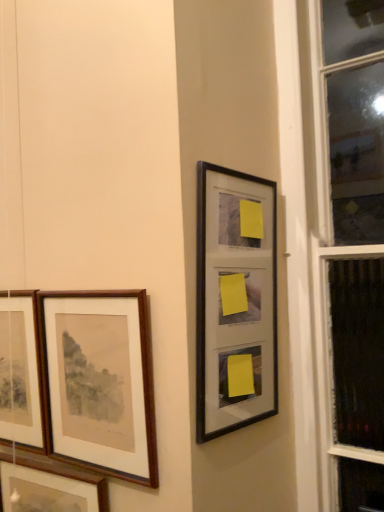
What do you see at coordinates (100, 381) in the screenshot? I see `wooden frame at left, placed as the second picture frame when sorted from right to left` at bounding box center [100, 381].

In order to face wooden framed picture at left, which ranks as the second picture frame in left-to-right order, should I rotate leftwards or rightwards?

You should look left and rotate roughly 18.734 degrees.

In order to face wooden picture frame at left, arranged as the fourth picture frame when viewed from the right, should I rotate leftwards or rightwards?

Rotate left and turn 24.182 degrees.

Identify the location of wooden frame at left, placed as the 3th picture frame when sorted from left to right. (100, 381).

Would you consider black matte picture frame at upper right, which is counted as the 1th picture frame, starting from the right, to be distant from wooden framed picture at left, positioned as the 3th picture frame in right-to-left order?

They are positioned close to each other.

From a real-world perspective, starting from the wooden framed picture at left, positioned as the 3th picture frame in right-to-left order, which picture frame is the 3rd one vertically above it? Please provide its 2D coordinates.

[(235, 301)]

What's the angular difference between black matte picture frame at upper right, which is counted as the 1th picture frame, starting from the right, and wooden framed picture at left, which ranks as the second picture frame in left-to-right order,'s facing directions?

The angle between the facing direction of black matte picture frame at upper right, which is counted as the 1th picture frame, starting from the right, and the facing direction of wooden framed picture at left, which ranks as the second picture frame in left-to-right order, is 77.6 degrees.

From the image's perspective, is black matte picture frame at upper right, which is counted as the 1th picture frame, starting from the right, located above or below wooden framed picture at left, which ranks as the second picture frame in left-to-right order?

black matte picture frame at upper right, which is counted as the 1th picture frame, starting from the right, is situated higher than wooden framed picture at left, which ranks as the second picture frame in left-to-right order, in the image.

Is wooden picture frame at left, arranged as the fourth picture frame when viewed from the right, behind wooden framed picture at left, which ranks as the second picture frame in left-to-right order?

Yes.

From the image's perspective, which is above, wooden picture frame at left, arranged as the fourth picture frame when viewed from the right, or wooden framed picture at left, which ranks as the second picture frame in left-to-right order?

wooden picture frame at left, arranged as the fourth picture frame when viewed from the right, appears higher in the image.

In terms of width, does wooden picture frame at left, arranged as the fourth picture frame when viewed from the right, look wider or thinner when compared to wooden framed picture at left, which ranks as the second picture frame in left-to-right order?

In the image, wooden picture frame at left, arranged as the fourth picture frame when viewed from the right, appears to be more narrow than wooden framed picture at left, which ranks as the second picture frame in left-to-right order.

Looking at this image, is wooden frame at left, placed as the 3th picture frame when sorted from left to right, not close to wooden picture frame at left, arranged as the fourth picture frame when viewed from the right?

They are positioned close to each other.

Considering the relative sizes of wooden frame at left, placed as the second picture frame when sorted from right to left, and wooden picture frame at left, the first picture frame from the left, in the image provided, is wooden frame at left, placed as the second picture frame when sorted from right to left, shorter than wooden picture frame at left, the first picture frame from the left,?

Correct, wooden frame at left, placed as the second picture frame when sorted from right to left, is not as tall as wooden picture frame at left, the first picture frame from the left.

From the image's perspective, does wooden frame at left, placed as the second picture frame when sorted from right to left, appear lower than wooden picture frame at left, arranged as the fourth picture frame when viewed from the right?

Incorrect, from the image's perspective, wooden frame at left, placed as the second picture frame when sorted from right to left, is higher than wooden picture frame at left, arranged as the fourth picture frame when viewed from the right.

Which of these two, wooden picture frame at left, the first picture frame from the left, or wooden frame at left, placed as the 3th picture frame when sorted from left to right, stands taller?

With more height is wooden picture frame at left, the first picture frame from the left.

From the image's perspective, is wooden picture frame at left, the first picture frame from the left, on top of wooden frame at left, placed as the second picture frame when sorted from right to left?

No.

Considering their positions, is wooden picture frame at left, the first picture frame from the left, located in front of or behind wooden frame at left, placed as the 3th picture frame when sorted from left to right?

Clearly, wooden picture frame at left, the first picture frame from the left, is behind wooden frame at left, placed as the 3th picture frame when sorted from left to right.

Does wooden picture frame at left, the first picture frame from the left, turn towards wooden frame at left, placed as the 3th picture frame when sorted from left to right?

No.

In the image, is wooden frame at left, placed as the 3th picture frame when sorted from left to right, positioned in front of or behind black matte picture frame at upper right, which is counted as the 1th picture frame, starting from the right?

Visually, wooden frame at left, placed as the 3th picture frame when sorted from left to right, is located behind black matte picture frame at upper right, which is counted as the 1th picture frame, starting from the right.

Is wooden frame at left, placed as the second picture frame when sorted from right to left, to the left of black matte picture frame at upper right, which is counted as the 1th picture frame, starting from the right, from the viewer's perspective?

Indeed, wooden frame at left, placed as the second picture frame when sorted from right to left, is positioned on the left side of black matte picture frame at upper right, which is counted as the 1th picture frame, starting from the right.

Is wooden frame at left, placed as the 3th picture frame when sorted from left to right, oriented towards black matte picture frame at upper right, which is counted as the 1th picture frame, starting from the right?

No, wooden frame at left, placed as the 3th picture frame when sorted from left to right, does not turn towards black matte picture frame at upper right, which is counted as the 1th picture frame, starting from the right.

Which of these two, wooden frame at left, placed as the 3th picture frame when sorted from left to right, or black matte picture frame at upper right, which is counted as the 1th picture frame, starting from the right, stands shorter?

wooden frame at left, placed as the 3th picture frame when sorted from left to right, is shorter.

Is wooden picture frame at left, arranged as the fourth picture frame when viewed from the right, in contact with black matte picture frame at upper right, the fourth picture frame viewed from the left?

No.

Is wooden picture frame at left, arranged as the fourth picture frame when viewed from the right, looking in the opposite direction of black matte picture frame at upper right, the fourth picture frame viewed from the left?

No, black matte picture frame at upper right, the fourth picture frame viewed from the left, is not at the back of wooden picture frame at left, arranged as the fourth picture frame when viewed from the right.

From a real-world perspective, is wooden picture frame at left, arranged as the fourth picture frame when viewed from the right, above or below black matte picture frame at upper right, which is counted as the 1th picture frame, starting from the right?

wooden picture frame at left, arranged as the fourth picture frame when viewed from the right, is situated lower than black matte picture frame at upper right, which is counted as the 1th picture frame, starting from the right, in the real world.

Is point (42, 397) positioned after point (234, 339)?

That is True.

Does black matte picture frame at upper right, which is counted as the 1th picture frame, starting from the right, have a greater width compared to wooden picture frame at left, the first picture frame from the left?

In fact, black matte picture frame at upper right, which is counted as the 1th picture frame, starting from the right, might be narrower than wooden picture frame at left, the first picture frame from the left.

Are black matte picture frame at upper right, which is counted as the 1th picture frame, starting from the right, and wooden picture frame at left, the first picture frame from the left, making contact?

No, black matte picture frame at upper right, which is counted as the 1th picture frame, starting from the right, is not in contact with wooden picture frame at left, the first picture frame from the left.

From a real-world perspective, which is physically below, black matte picture frame at upper right, the fourth picture frame viewed from the left, or wooden picture frame at left, arranged as the fourth picture frame when viewed from the right?

In real-world perspective, wooden picture frame at left, arranged as the fourth picture frame when viewed from the right, is lower.

Is point (223, 180) closer or farther from the camera than point (18, 301)?

Point (223, 180).

You are a GUI agent. You are given a task and a screenshot of the screen. Output one action in this format:
    pyautogui.click(x=<x>, y=<y>)
    Task: Click on the picture frame that is the 3rd one when counting upward from the wooden framed picture at left, which ranks as the second picture frame in left-to-right order (from the image's perspective)
    The image size is (384, 512).
    Given the screenshot: What is the action you would take?
    pyautogui.click(x=235, y=301)

This screenshot has width=384, height=512. I want to click on picture frame that is the 2nd object directly below the wooden picture frame at left, the first picture frame from the left (from a real-world perspective), so click(49, 486).

Which object lies further to the anchor point wooden framed picture at left, positioned as the 3th picture frame in right-to-left order, wooden picture frame at left, the first picture frame from the left, or black matte picture frame at upper right, the fourth picture frame viewed from the left?

black matte picture frame at upper right, the fourth picture frame viewed from the left.

Which object lies nearer to the anchor point black matte picture frame at upper right, which is counted as the 1th picture frame, starting from the right, wooden framed picture at left, positioned as the 3th picture frame in right-to-left order, or wooden frame at left, placed as the 3th picture frame when sorted from left to right?

Based on the image, wooden frame at left, placed as the 3th picture frame when sorted from left to right, appears to be nearer to black matte picture frame at upper right, which is counted as the 1th picture frame, starting from the right.

Looking at the image, which one is located closer to wooden picture frame at left, arranged as the fourth picture frame when viewed from the right, wooden framed picture at left, which ranks as the second picture frame in left-to-right order, or wooden frame at left, placed as the second picture frame when sorted from right to left?

wooden frame at left, placed as the second picture frame when sorted from right to left.

Looking at this image, estimate the real-world distances between objects in this image. Which object is further from wooden frame at left, placed as the 3th picture frame when sorted from left to right, wooden picture frame at left, the first picture frame from the left, or wooden framed picture at left, which ranks as the second picture frame in left-to-right order?

Based on the image, wooden framed picture at left, which ranks as the second picture frame in left-to-right order, appears to be further to wooden frame at left, placed as the 3th picture frame when sorted from left to right.

Considering their positions, is wooden frame at left, placed as the 3th picture frame when sorted from left to right, positioned closer to black matte picture frame at upper right, which is counted as the 1th picture frame, starting from the right, than wooden picture frame at left, arranged as the fourth picture frame when viewed from the right?

wooden frame at left, placed as the 3th picture frame when sorted from left to right, is positioned closer to the anchor black matte picture frame at upper right, which is counted as the 1th picture frame, starting from the right.

From the image, which object appears to be farther from wooden picture frame at left, arranged as the fourth picture frame when viewed from the right, wooden frame at left, placed as the 3th picture frame when sorted from left to right, or wooden framed picture at left, which ranks as the second picture frame in left-to-right order?

wooden framed picture at left, which ranks as the second picture frame in left-to-right order, is positioned further to the anchor wooden picture frame at left, arranged as the fourth picture frame when viewed from the right.

From the image, which object appears to be nearer to wooden picture frame at left, the first picture frame from the left, wooden framed picture at left, which ranks as the second picture frame in left-to-right order, or black matte picture frame at upper right, which is counted as the 1th picture frame, starting from the right?

wooden framed picture at left, which ranks as the second picture frame in left-to-right order, is closer to wooden picture frame at left, the first picture frame from the left.

When comparing their distances from black matte picture frame at upper right, the fourth picture frame viewed from the left, does wooden picture frame at left, arranged as the fourth picture frame when viewed from the right, or wooden frame at left, placed as the 3th picture frame when sorted from left to right, seem closer?

wooden frame at left, placed as the 3th picture frame when sorted from left to right.

At what (x,y) coordinates should I click in order to perform the action: click on picture frame between wooden frame at left, placed as the 3th picture frame when sorted from left to right, and wooden framed picture at left, which ranks as the second picture frame in left-to-right order, in the vertical direction. Please return your answer as a coordinate pair (x, y). The height and width of the screenshot is (512, 384). Looking at the image, I should click on (20, 372).